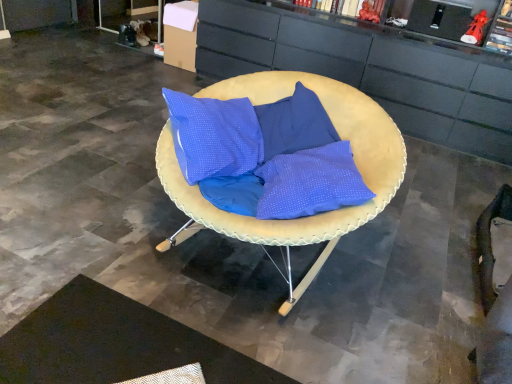
Question: In terms of height, does matte black cabinet at center look taller or shorter compared to black textured mat at lower left?

Choices:
 (A) short
 (B) tall

Answer: (B)

Question: Would you say matte black cabinet at center is inside or outside black textured mat at lower left?

Choices:
 (A) inside
 (B) outside

Answer: (B)

Question: Based on their relative distances, which object is nearer to the matte yellow cushion at center?

Choices:
 (A) black textured mat at lower left
 (B) matte black cabinet at center

Answer: (A)

Question: Considering the real-world distances, which object is farthest from the matte yellow cushion at center?

Choices:
 (A) black textured mat at lower left
 (B) matte black cabinet at center

Answer: (B)